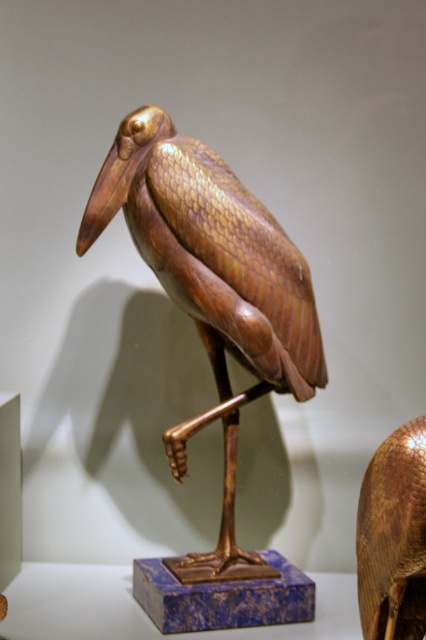
Who is shorter, shiny gold bird at center or gold textured bird at center?

Standing shorter between the two is gold textured bird at center.

Between point (123, 145) and point (417, 428), which one is positioned behind?

The point (123, 145) is more distant.

The width and height of the screenshot is (426, 640). Describe the element at coordinates (212, 253) in the screenshot. I see `shiny gold bird at center` at that location.

You are a GUI agent. You are given a task and a screenshot of the screen. Output one action in this format:
    pyautogui.click(x=<x>, y=<y>)
    Task: Click on the shiny gold bird at center
    The width and height of the screenshot is (426, 640).
    Given the screenshot: What is the action you would take?
    pyautogui.click(x=212, y=253)